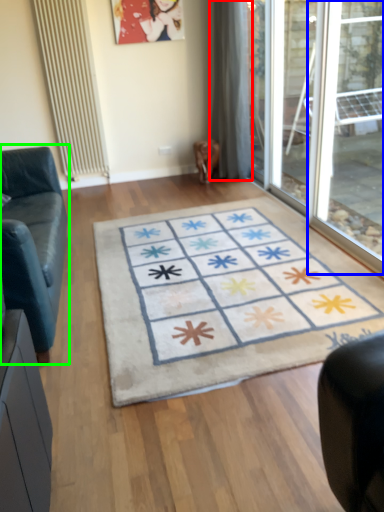
Question: Based on their relative distances, which object is nearer to curtain (highlighted by a red box)? Choose from window (highlighted by a blue box) and studio couch (highlighted by a green box).

Choices:
 (A) window
 (B) studio couch

Answer: (A)